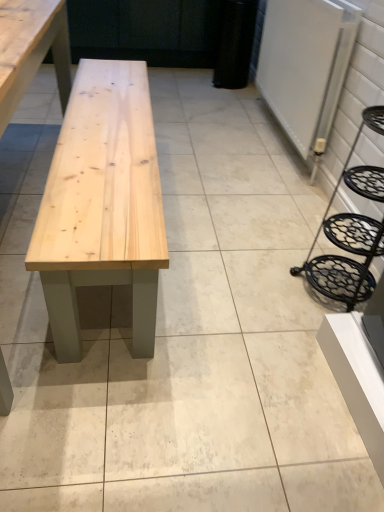
Identify the location of vacant space underneath black wrought iron step stool at right (from a real-world perspective). The image size is (384, 512). (329, 287).